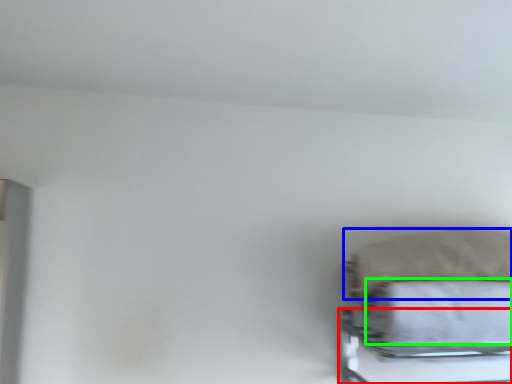
Question: Which object is the closest to the bed frame (highlighted by a red box)? Choose among these: pillow (highlighted by a blue box) or bath towel (highlighted by a green box).

Choices:
 (A) pillow
 (B) bath towel

Answer: (B)